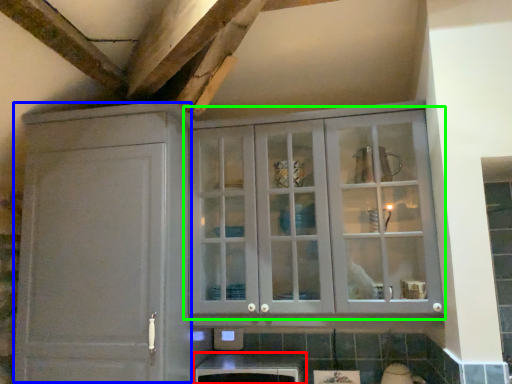
Question: Based on their relative distances, which object is nearer to cabinetry (highlighted by a red box)? Choose from cabinetry (highlighted by a blue box) and cupboard (highlighted by a green box).

Choices:
 (A) cabinetry
 (B) cupboard

Answer: (A)